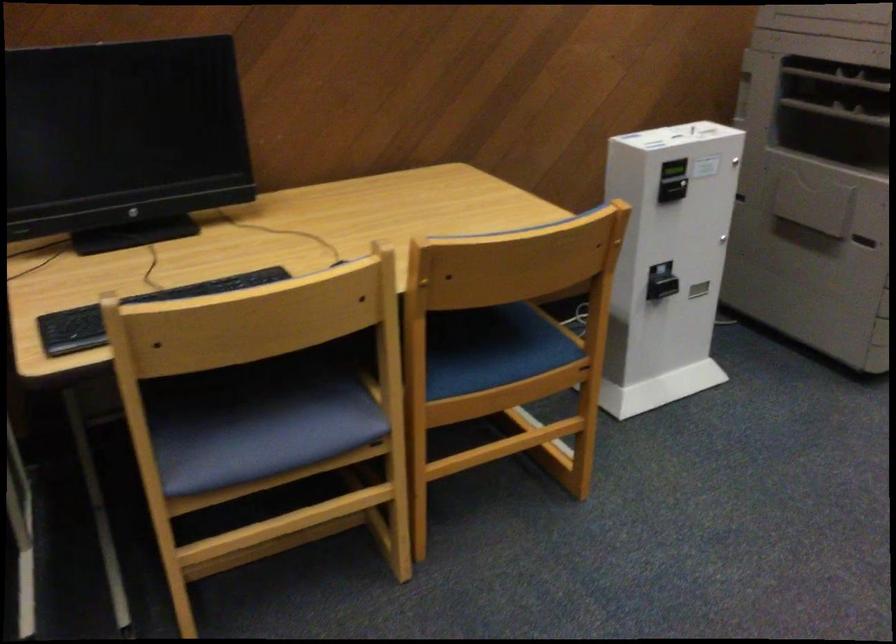
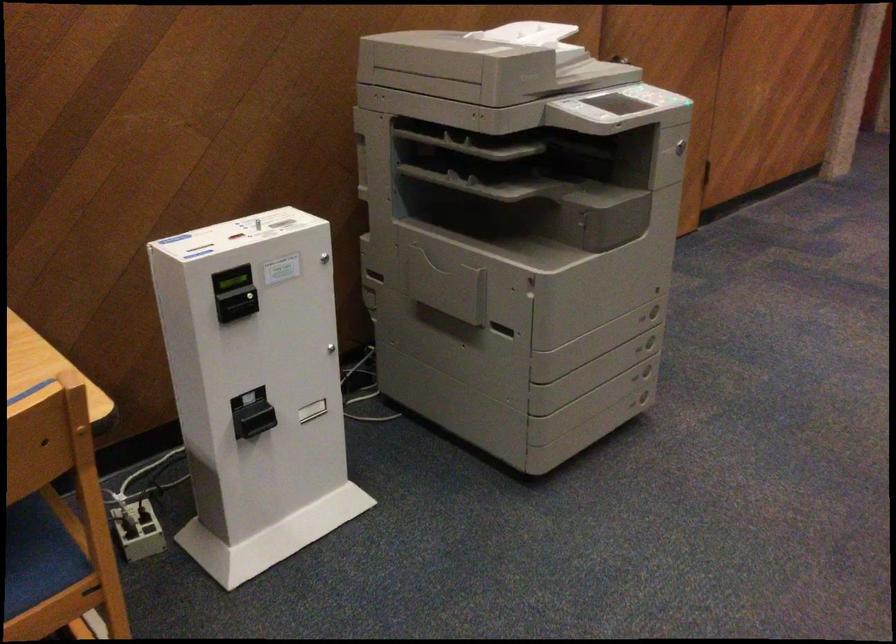
Question: Based on the continuous images, in which direction is the camera rotating? Reply with the corresponding letter.

Choices:
 (A) Left
 (B) Right
 (C) Up
 (D) Down

Answer: (B)